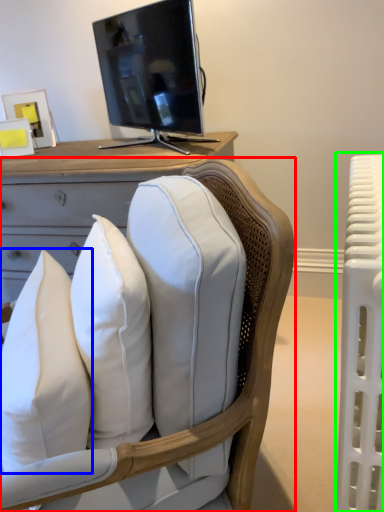
Question: Based on their relative distances, which object is nearer to chair (highlighted by a red box)? Choose from pillow (highlighted by a blue box) and radiator (highlighted by a green box).

Choices:
 (A) pillow
 (B) radiator

Answer: (A)